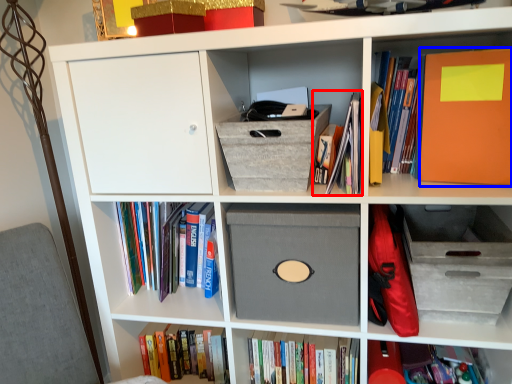
Question: Which point is closer to the camera, book (highlighted by a red box) or paperback book (highlighted by a blue box)?

Choices:
 (A) book
 (B) paperback book

Answer: (B)